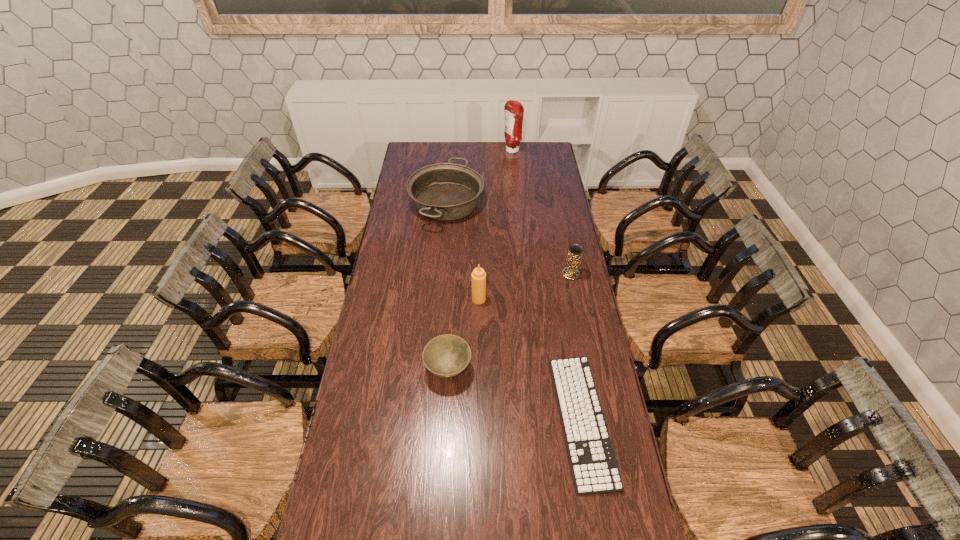
Where is `vacant space situated on the front of the fourth object from left to right`? vacant space situated on the front of the fourth object from left to right is located at coordinates (516, 185).

Locate an element on the screen. This screenshot has width=960, height=540. free point located on the front of the third nearest object is located at coordinates (479, 365).

I want to click on vacant area situated on the back of the third tallest object, so click(561, 220).

What are the coordinates of `free space located 0.280m on the right of the second farthest object` in the screenshot? It's located at (538, 204).

At what (x,y) coordinates should I click in order to perform the action: click on free location located 0.180m on the front of the fifth tallest object. Please return your answer as a coordinate pair (x, y). The image size is (960, 540). Looking at the image, I should click on pyautogui.click(x=444, y=440).

In order to click on vacant area situated 0.120m on the left of the shortest object in this screenshot , I will do `click(519, 420)`.

You are a GUI agent. You are given a task and a screenshot of the screen. Output one action in this format:
    pyautogui.click(x=<x>, y=<y>)
    Task: Click on the object that is at the far edge
    
    Given the screenshot: What is the action you would take?
    pyautogui.click(x=513, y=110)

This screenshot has height=540, width=960. Find the location of `object positioned at the left edge`. object positioned at the left edge is located at coordinates (445, 191).

Find the location of a particular element. The width and height of the screenshot is (960, 540). chalice located at the right edge is located at coordinates (575, 250).

Locate an element on the screen. Image resolution: width=960 pixels, height=540 pixels. computer keyboard that is at the right edge is located at coordinates (594, 469).